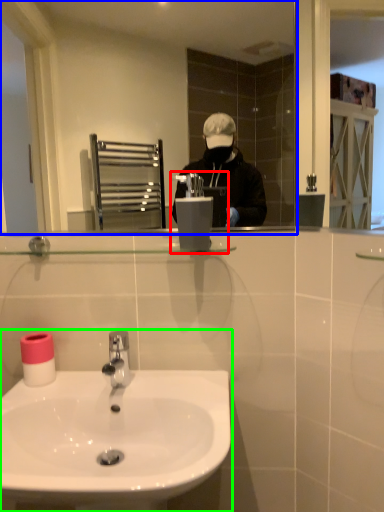
Question: Which object is the farthest from hand dryer (highlighted by a red box)? Choose among these: mirror (highlighted by a blue box) or sink (highlighted by a green box).

Choices:
 (A) mirror
 (B) sink

Answer: (A)